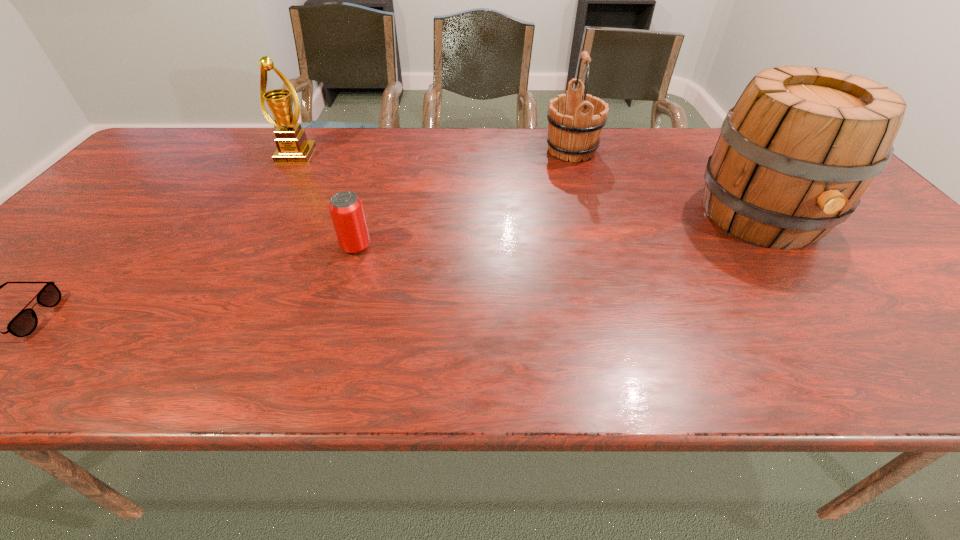
Where is `the rightmost object`? the rightmost object is located at coordinates (800, 147).

Identify the location of award. This screenshot has height=540, width=960. (292, 145).

This screenshot has height=540, width=960. Find the location of `wine bucket`. wine bucket is located at coordinates pyautogui.click(x=575, y=126).

This screenshot has height=540, width=960. I want to click on can, so click(x=346, y=210).

Locate an element on the screen. the third object from right to left is located at coordinates (346, 210).

The width and height of the screenshot is (960, 540). I want to click on vacant space situated on the side of the cider where the spigot is located, so click(866, 357).

Image resolution: width=960 pixels, height=540 pixels. In order to click on vacant position located on the front-facing side of the award in this screenshot , I will do `click(273, 195)`.

The image size is (960, 540). I want to click on blank area located on the front of the fourth object from left to right, so click(582, 184).

At what (x,y) coordinates should I click in order to perform the action: click on vacant space situated 0.320m on the back of the third object from left to right. Please return your answer as a coordinate pair (x, y). The width and height of the screenshot is (960, 540). Looking at the image, I should click on (380, 166).

Find the location of a particular element. Image resolution: width=960 pixels, height=540 pixels. award located at the far edge is located at coordinates (292, 145).